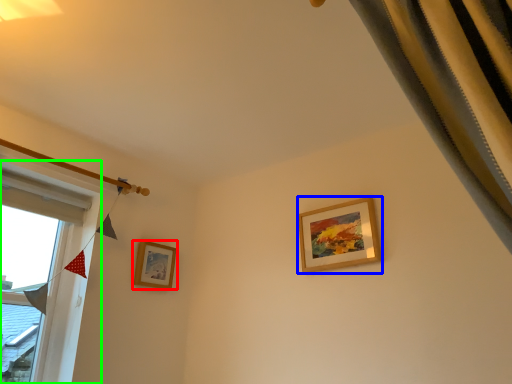
Question: Which object is the farthest from picture frame (highlighted by a red box)? Choose among these: picture frame (highlighted by a blue box) or window (highlighted by a green box).

Choices:
 (A) picture frame
 (B) window

Answer: (A)